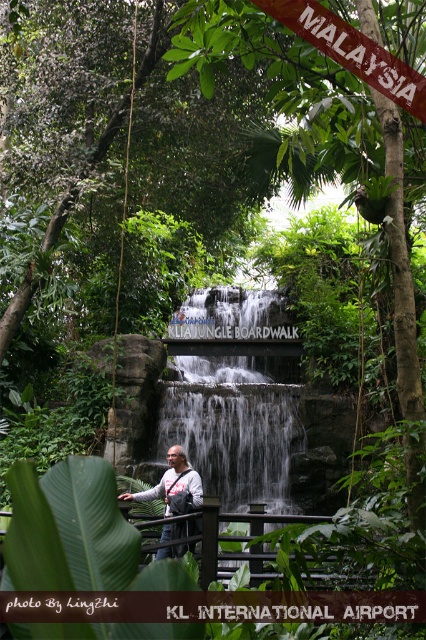
Does white textured water at center have a larger size compared to matte gray backpack at center?

No, white textured water at center is not bigger than matte gray backpack at center.

Between white textured water at center and matte gray backpack at center, which one has less height?

white textured water at center

Between point (157, 428) and point (199, 486), which one is positioned in front?

Point (199, 486) is more forward.

Where is `white textured water at center`? The image size is (426, 640). white textured water at center is located at coordinates (233, 426).